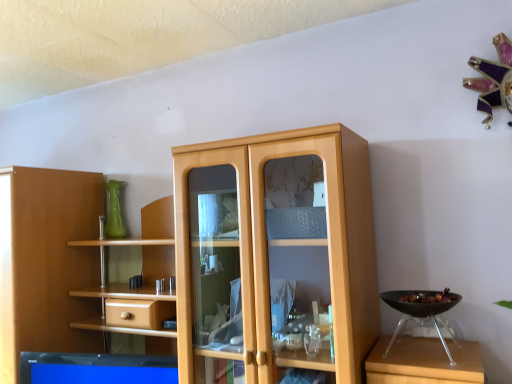
Where is `light wood cupboard at center`? The width and height of the screenshot is (512, 384). light wood cupboard at center is located at coordinates (274, 255).

What is the approximate width of green glass vase at upper left?

green glass vase at upper left is 9.82 centimeters wide.

Image resolution: width=512 pixels, height=384 pixels. I want to click on black plastic bowl at right, so click(422, 310).

Who is more distant, black plastic bowl at right or green glass vase at upper left?

green glass vase at upper left is behind.

Does black plastic bowl at right appear on the left side of green glass vase at upper left?

In fact, black plastic bowl at right is to the right of green glass vase at upper left.

Is black plastic bowl at right not near green glass vase at upper left?

black plastic bowl at right is far away from green glass vase at upper left.

Where is `appliance lying behind the light wood cupboard at center`? appliance lying behind the light wood cupboard at center is located at coordinates (422, 310).

Is light wood cupboard at center oriented towards black plastic bowl at right?

No.

Considering the points (238, 194) and (413, 293), which point is behind, point (238, 194) or point (413, 293)?

The point (413, 293) is behind.

Is green glass vase at upper left far from light wood cupboard at center?

Yes, green glass vase at upper left and light wood cupboard at center are quite far apart.

Locate an element on the screen. The height and width of the screenshot is (384, 512). glass vase behind the light wood cupboard at center is located at coordinates (114, 211).

From the image's perspective, is green glass vase at upper left positioned above or below light wood cupboard at center?

Based on their image positions, green glass vase at upper left is located above light wood cupboard at center.

From a real-world perspective, is green glass vase at upper left on top of light wood cupboard at center?

Correct, in the physical world, green glass vase at upper left is higher than light wood cupboard at center.

Which is in front, point (122, 184) or point (398, 307)?

Point (398, 307)

Is green glass vase at upper left directly adjacent to black plastic bowl at right?

No, green glass vase at upper left is not next to black plastic bowl at right.

Considering the sizes of objects green glass vase at upper left and black plastic bowl at right in the image provided, who is thinner, green glass vase at upper left or black plastic bowl at right?

Thinner between the two is green glass vase at upper left.

Which is more to the right, green glass vase at upper left or black plastic bowl at right?

Positioned to the right is black plastic bowl at right.

Could you tell me if black plastic bowl at right is facing light wood cupboard at center?

No, black plastic bowl at right is not facing towards light wood cupboard at center.

Is black plastic bowl at right taller or shorter than light wood cupboard at center?

black plastic bowl at right is shorter than light wood cupboard at center.

From the image's perspective, is black plastic bowl at right on light wood cupboard at center?

Yes.

From the picture: Which is behind, black plastic bowl at right or light wood cupboard at center?

black plastic bowl at right is further from the camera.

Is light wood cupboard at center in contact with green glass vase at upper left?

light wood cupboard at center and green glass vase at upper left are not in contact.

Who is bigger, light wood cupboard at center or green glass vase at upper left?

With larger size is light wood cupboard at center.

Is the position of light wood cupboard at center less distant than that of green glass vase at upper left?

Yes, the depth of light wood cupboard at center is less than that of green glass vase at upper left.

Locate an element on the screen. This screenshot has width=512, height=384. glass vase above the black plastic bowl at right (from the image's perspective) is located at coordinates (114, 211).

At what (x,y) coordinates should I click in order to perform the action: click on appliance beneath the light wood cupboard at center (from a real-world perspective). Please return your answer as a coordinate pair (x, y). This screenshot has width=512, height=384. Looking at the image, I should click on tap(422, 310).

When comparing their distances from green glass vase at upper left, does black plastic bowl at right or light wood cupboard at center seem further?

black plastic bowl at right is further to green glass vase at upper left.

Which object lies further to the anchor point light wood cupboard at center, black plastic bowl at right or green glass vase at upper left?

The object further to light wood cupboard at center is green glass vase at upper left.

When comparing their distances from light wood cupboard at center, does green glass vase at upper left or black plastic bowl at right seem closer?

black plastic bowl at right is closer to light wood cupboard at center.

Which object lies nearer to the anchor point green glass vase at upper left, light wood cupboard at center or black plastic bowl at right?

light wood cupboard at center lies closer to green glass vase at upper left than the other object.

Which object lies nearer to the anchor point black plastic bowl at right, light wood cupboard at center or green glass vase at upper left?

Based on the image, light wood cupboard at center appears to be nearer to black plastic bowl at right.

Looking at the image, which one is located further to black plastic bowl at right, green glass vase at upper left or light wood cupboard at center?

The object further to black plastic bowl at right is green glass vase at upper left.

You are a GUI agent. You are given a task and a screenshot of the screen. Output one action in this format:
    pyautogui.click(x=<x>, y=<y>)
    Task: Click on the cupboard located between green glass vase at upper left and black plastic bowl at right in the left-right direction
    
    Given the screenshot: What is the action you would take?
    pyautogui.click(x=274, y=255)